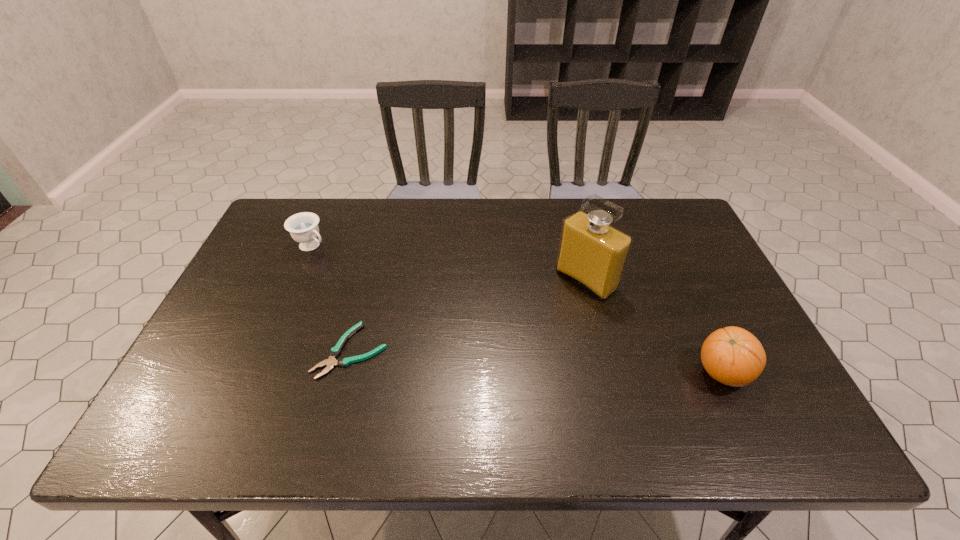
This screenshot has width=960, height=540. In order to click on the shortest object in this screenshot , I will do `click(336, 350)`.

Locate an element on the screen. Image resolution: width=960 pixels, height=540 pixels. pliers is located at coordinates (336, 350).

This screenshot has height=540, width=960. I want to click on orange, so click(733, 356).

Image resolution: width=960 pixels, height=540 pixels. In order to click on the third shortest object in this screenshot , I will do `click(733, 356)`.

This screenshot has height=540, width=960. What are the coordinates of `the leftmost object` in the screenshot? It's located at (303, 227).

The image size is (960, 540). What are the coordinates of `the farthest object` in the screenshot? It's located at (303, 227).

The height and width of the screenshot is (540, 960). Identify the location of perfume. (x=592, y=253).

The image size is (960, 540). What are the coordinates of `the tallest object` in the screenshot? It's located at (592, 253).

Locate an element on the screen. vacant area located on the left of the pliers is located at coordinates (214, 350).

I want to click on vacant point located 0.060m on the back of the rightmost object, so click(x=704, y=331).